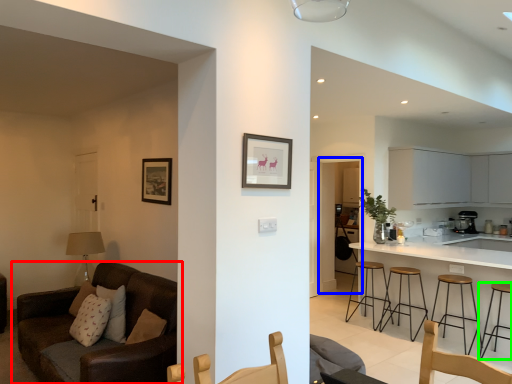
Question: Which is nearer to the studio couch (highlighted by a red box)? glass door (highlighted by a blue box) or stool (highlighted by a green box).

Choices:
 (A) glass door
 (B) stool

Answer: (B)